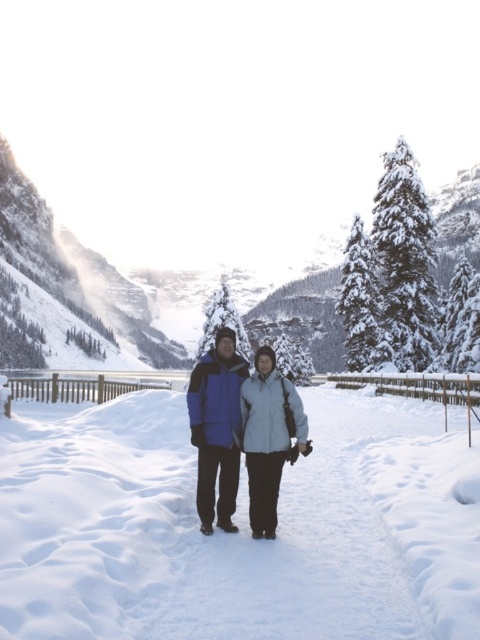
Question: Which of the following is the farthest from the observer?

Choices:
 (A) (240, 412)
 (B) (0, 458)
 (C) (210, 298)
 (D) (271, 358)

Answer: (C)

Question: Which point is farther from the camera taking this photo?

Choices:
 (A) (225, 394)
 (B) (287, 397)
 (C) (240, 320)

Answer: (C)

Question: Can you confirm if snowy granite mountain at center is positioned to the left of green matte pine at center?

Choices:
 (A) yes
 (B) no

Answer: (B)

Question: Is the position of blue synthetic jacket at center less distant than that of green matte pine at center?

Choices:
 (A) yes
 (B) no

Answer: (A)

Question: Which point is farther from the camera taking this photo?

Choices:
 (A) (266, 500)
 (B) (213, 314)

Answer: (B)

Question: Does snowy granite mountain at center lie in front of blue synthetic jacket at center?

Choices:
 (A) yes
 (B) no

Answer: (B)